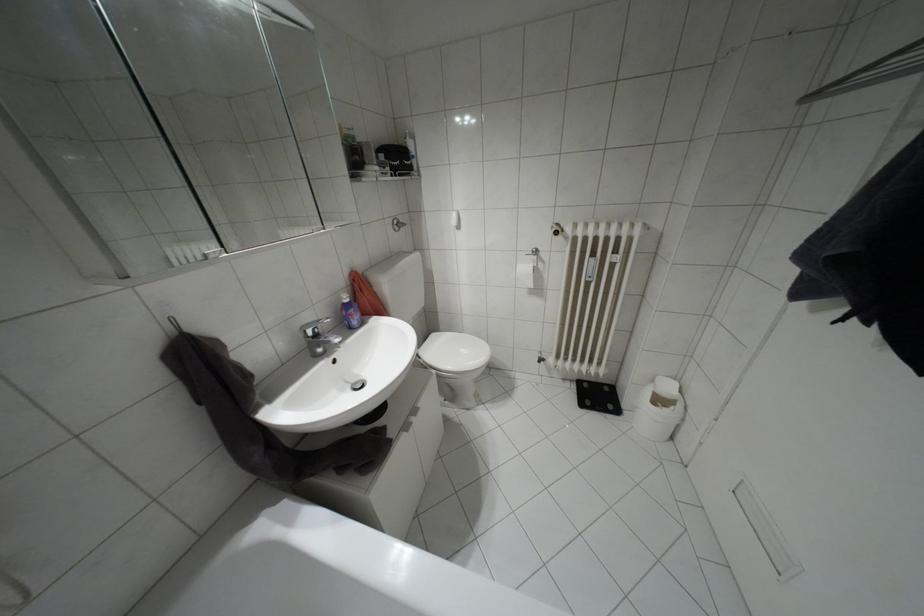
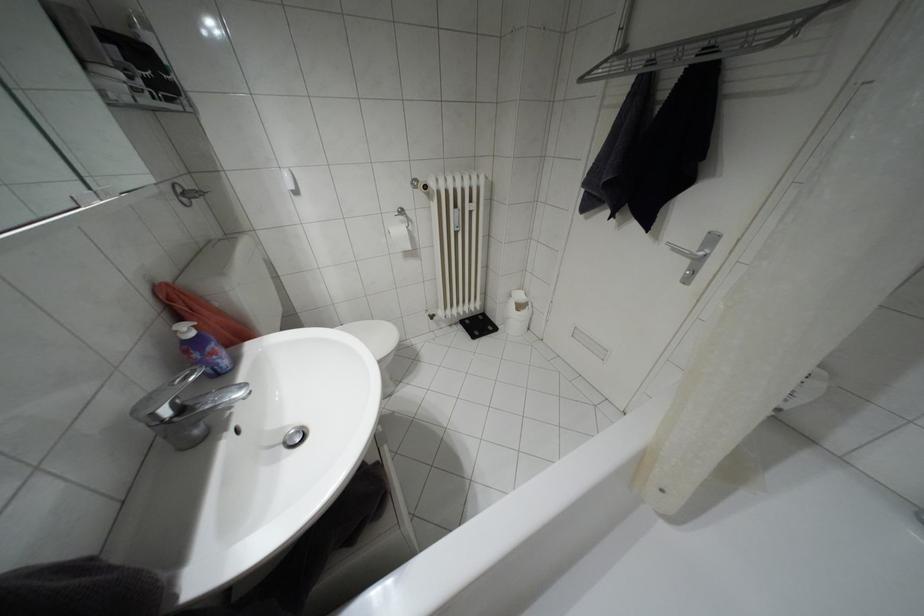
Find the pixel in the second image that matches pixel 580 405 in the first image.

(472, 336)